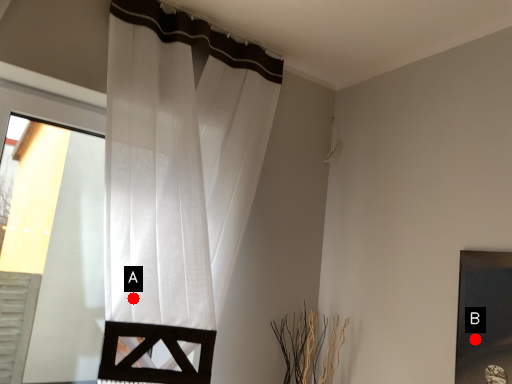
Question: Two points are circled on the image, labeled by A and B beside each circle. Which point is closer to the camera?

Choices:
 (A) A is closer
 (B) B is closer

Answer: (B)